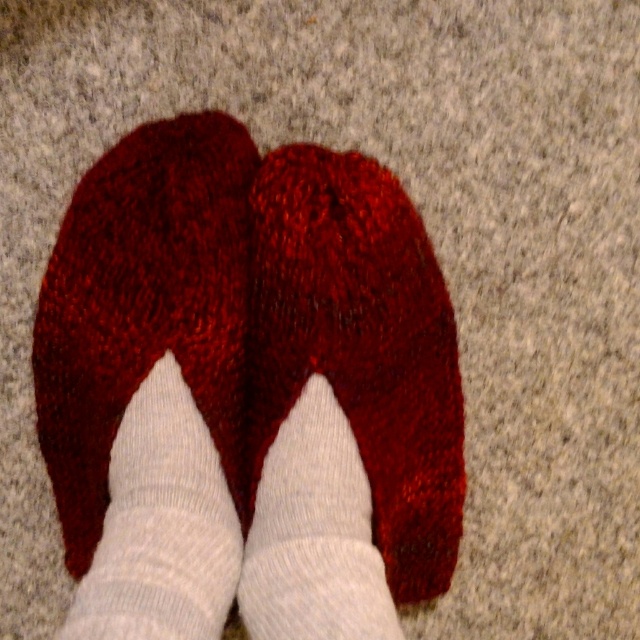
Is knitted wool sock at center shorter than white knitted sock at center?

Incorrect, knitted wool sock at center's height does not fall short of white knitted sock at center's.

Is point (40, 406) farther from viewer compared to point (140, 538)?

Yes, it is behind point (140, 538).

Where is `knitted wool sock at center`? The width and height of the screenshot is (640, 640). knitted wool sock at center is located at coordinates (145, 307).

The height and width of the screenshot is (640, 640). What do you see at coordinates (253, 323) in the screenshot?
I see `shiny red slippers at center` at bounding box center [253, 323].

From the picture: Does shiny red slippers at center have a greater height compared to knitted wool sock at center?

Correct, shiny red slippers at center is much taller as knitted wool sock at center.

Who is more forward, (387, 352) or (196, 284)?

Point (196, 284) is more forward.

At what (x,y) coordinates should I click in order to perform the action: click on shiny red slippers at center. Please return your answer as a coordinate pair (x, y). Image resolution: width=640 pixels, height=640 pixels. Looking at the image, I should click on (253, 323).

Does point (404, 499) lie in front of point (173, 616)?

No, it is not.

Does shiny red slippers at center have a lesser height compared to white knitted sock at center?

In fact, shiny red slippers at center may be taller than white knitted sock at center.

Where is `shiny red slippers at center`? This screenshot has width=640, height=640. shiny red slippers at center is located at coordinates (253, 323).

Locate an element on the screen. Image resolution: width=640 pixels, height=640 pixels. shiny red slippers at center is located at coordinates (253, 323).